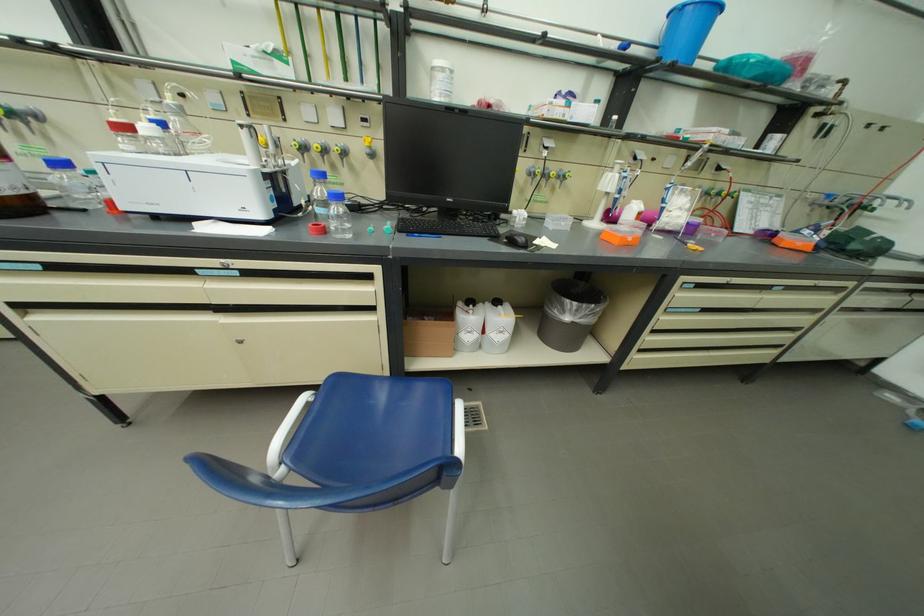
Where is `blue chair sitting surface`? blue chair sitting surface is located at coordinates (372, 427).